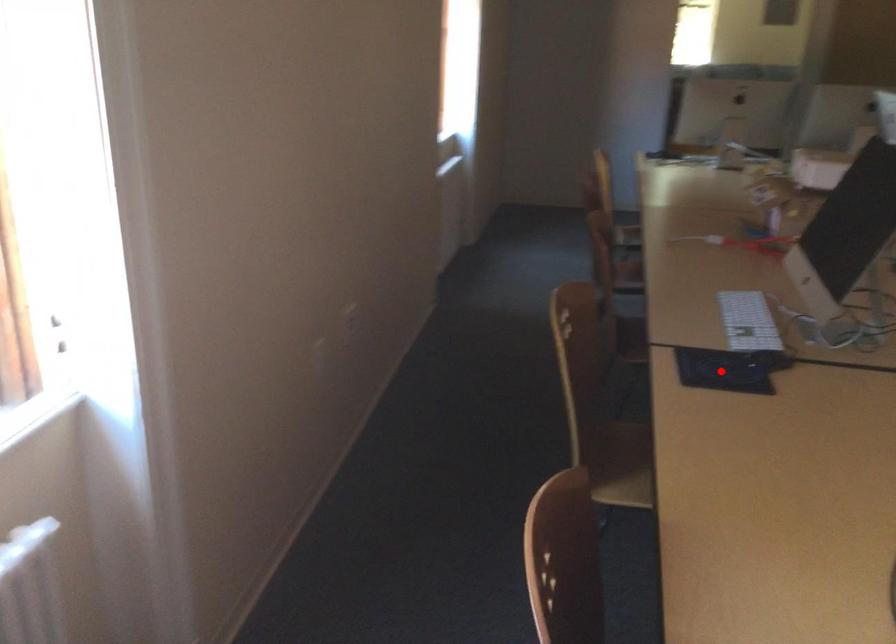
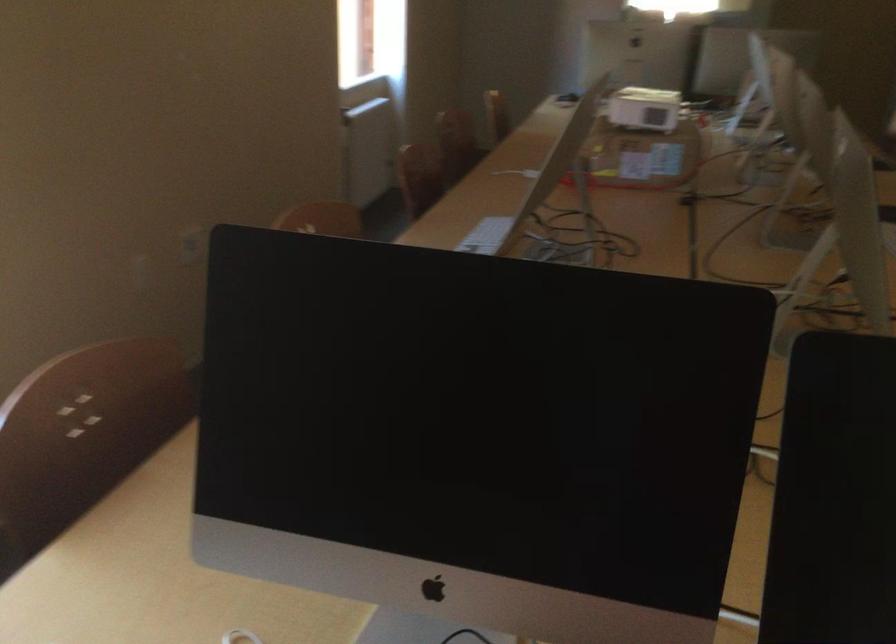
Question: I am providing you with two images of the same scene from different viewpoints. A red point is marked on the first image. At the location where the point appears in image 1, is it still visible in image 2?

Choices:
 (A) Yes
 (B) No

Answer: (B)